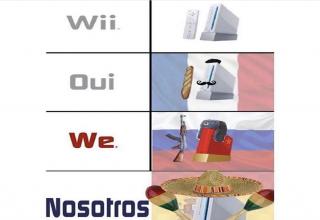
Where is `remote`? The width and height of the screenshot is (320, 220). remote is located at coordinates (192, 28).